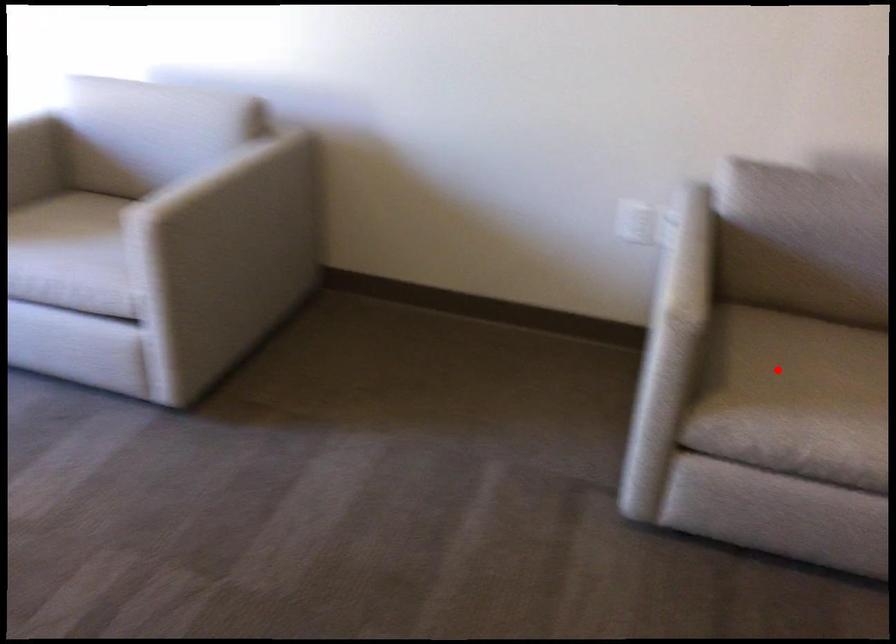
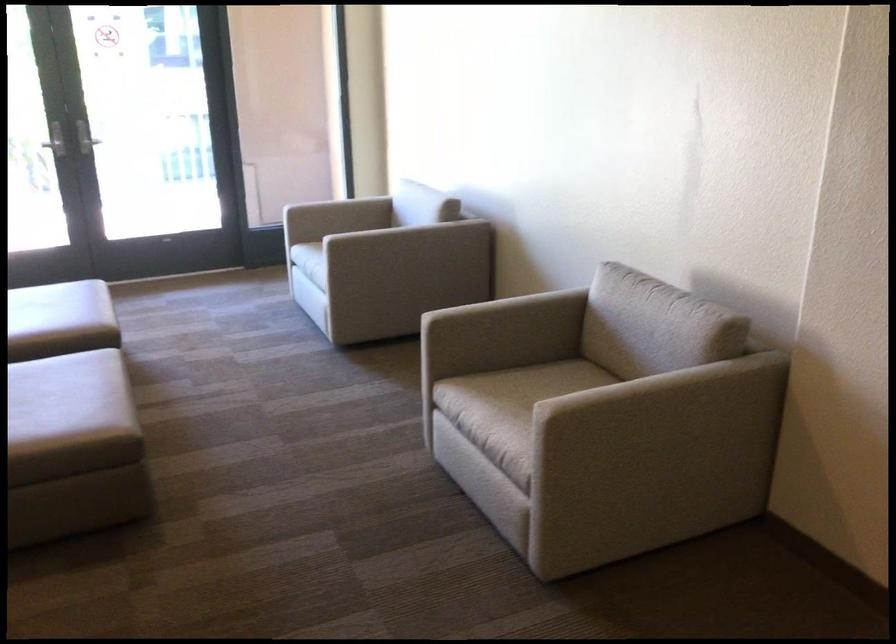
Question: I am providing you with two images of the same scene from different viewpoints. In image1, a red point is highlighted. Considering the same 3D point in image2, which of the following is correct?

Choices:
 (A) It is closer
 (B) It is farther

Answer: (B)